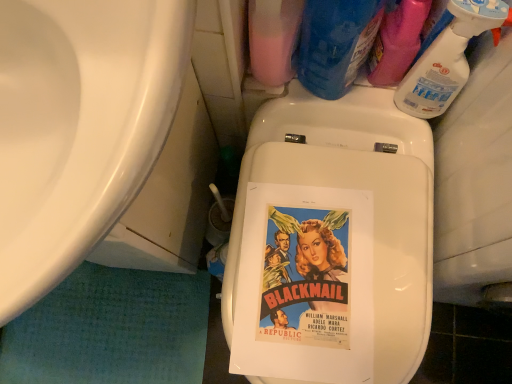
Question: Is the surface of pink matte bottle at upper center, the 1th cleaning product positioned from the left, in direct contact with blue plastic bottle at upper right, which is the 3th cleaning product from right to left?

Choices:
 (A) yes
 (B) no

Answer: (A)

Question: Is pink matte bottle at upper center, the 1th cleaning product positioned from the left, positioned with its back to blue plastic bottle at upper right, the second cleaning product viewed from the left?

Choices:
 (A) yes
 (B) no

Answer: (B)

Question: Considering the relative positions of pink matte bottle at upper center, the 1th cleaning product positioned from the left, and blue plastic bottle at upper right, which is the 3th cleaning product from right to left, in the image provided, is pink matte bottle at upper center, the 1th cleaning product positioned from the left, to the right of blue plastic bottle at upper right, which is the 3th cleaning product from right to left, from the viewer's perspective?

Choices:
 (A) no
 (B) yes

Answer: (A)

Question: From a real-world perspective, is pink matte bottle at upper center, which ranks as the fourth cleaning product in right-to-left order, physically below blue plastic bottle at upper right, which is the 3th cleaning product from right to left?

Choices:
 (A) yes
 (B) no

Answer: (B)

Question: Is pink matte bottle at upper center, which ranks as the fourth cleaning product in right-to-left order, surrounding blue plastic bottle at upper right, which is the 3th cleaning product from right to left?

Choices:
 (A) no
 (B) yes

Answer: (A)

Question: Visually, is pink matte bottle at upper center, the 1th cleaning product positioned from the left, positioned to the left or to the right of clear plastic spray bottle at upper right, positioned as the 1th cleaning product in right-to-left order?

Choices:
 (A) left
 (B) right

Answer: (A)

Question: In terms of width, does pink matte bottle at upper center, the 1th cleaning product positioned from the left, look wider or thinner when compared to clear plastic spray bottle at upper right, the 4th cleaning product when ordered from left to right?

Choices:
 (A) wide
 (B) thin

Answer: (A)

Question: Considering their positions, is pink matte bottle at upper center, the 1th cleaning product positioned from the left, located in front of or behind clear plastic spray bottle at upper right, positioned as the 1th cleaning product in right-to-left order?

Choices:
 (A) front
 (B) behind

Answer: (A)

Question: Is point (266, 76) positioned closer to the camera than point (398, 97)?

Choices:
 (A) farther
 (B) closer

Answer: (B)

Question: From a real-world perspective, relative to blue plastic bottle at upper right, the second cleaning product viewed from the left, is clear plastic spray bottle at upper right, positioned as the 1th cleaning product in right-to-left order, vertically above or below?

Choices:
 (A) below
 (B) above

Answer: (A)

Question: Is point (419, 69) positioned closer to the camera than point (325, 21)?

Choices:
 (A) closer
 (B) farther

Answer: (B)

Question: Considering the positions of clear plastic spray bottle at upper right, positioned as the 1th cleaning product in right-to-left order, and blue plastic bottle at upper right, the second cleaning product viewed from the left, in the image, is clear plastic spray bottle at upper right, positioned as the 1th cleaning product in right-to-left order, taller or shorter than blue plastic bottle at upper right, the second cleaning product viewed from the left,?

Choices:
 (A) tall
 (B) short

Answer: (B)

Question: From the image's perspective, is clear plastic spray bottle at upper right, the 4th cleaning product when ordered from left to right, above or below blue plastic bottle at upper right, the second cleaning product viewed from the left?

Choices:
 (A) above
 (B) below

Answer: (B)

Question: From a real-world perspective, is blue plastic bottle at upper right, the second cleaning product viewed from the left, above or below white glossy sink at left?

Choices:
 (A) below
 (B) above

Answer: (A)

Question: Looking at their shapes, would you say blue plastic bottle at upper right, which is the 3th cleaning product from right to left, is wider or thinner than white glossy sink at left?

Choices:
 (A) wide
 (B) thin

Answer: (B)